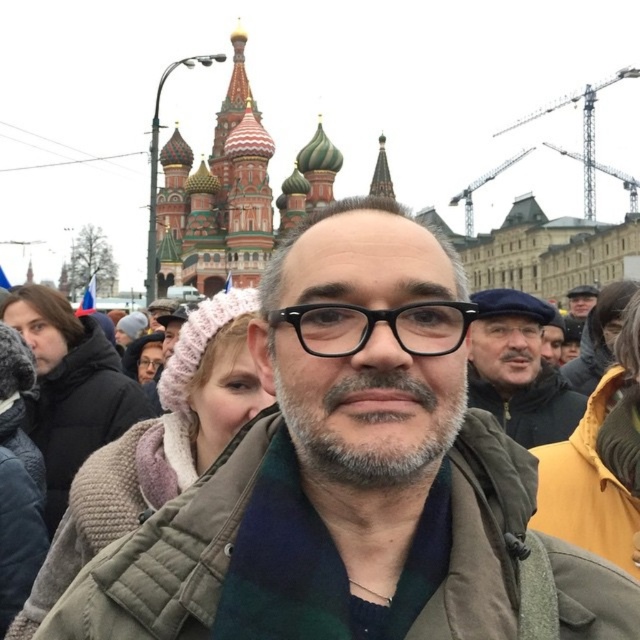
Does gray matte beard at center appear under dark gray knit hat at upper left?

Indeed, gray matte beard at center is positioned under dark gray knit hat at upper left.

How much distance is there between gray matte beard at center and dark gray knit hat at upper left?

A distance of 40.27 meters exists between gray matte beard at center and dark gray knit hat at upper left.

The height and width of the screenshot is (640, 640). In order to click on gray matte beard at center in this screenshot , I will do `click(368, 413)`.

Is point (403, 461) farther from viewer compared to point (96, 342)?

That is False.

In the scene shown: Which of these two, green plaid scarf at center or dark gray knit hat at upper left, stands taller?

green plaid scarf at center is taller.

Is point (364, 442) in front of point (6, 310)?

Yes, point (364, 442) is in front of point (6, 310).

Locate an element on the screen. The width and height of the screenshot is (640, 640). green plaid scarf at center is located at coordinates (337, 468).

Can you confirm if green plaid scarf at center is positioned above gray matte beard at center?

Actually, green plaid scarf at center is below gray matte beard at center.

In the scene shown: Does green plaid scarf at center come in front of gray matte beard at center?

Yes, it is.

Which is in front, point (461, 502) or point (380, 435)?

Point (380, 435) is more forward.

This screenshot has width=640, height=640. I want to click on green plaid scarf at center, so click(337, 468).